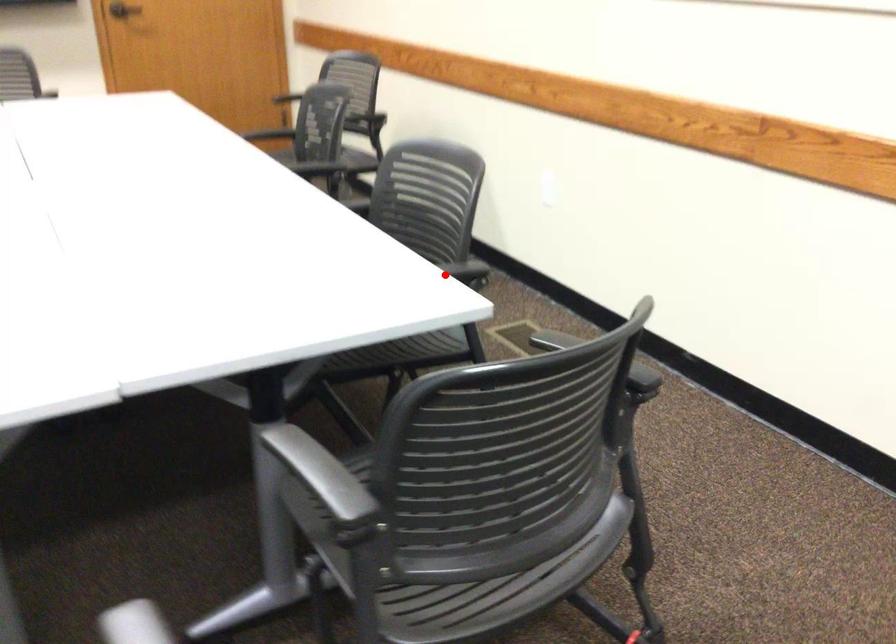
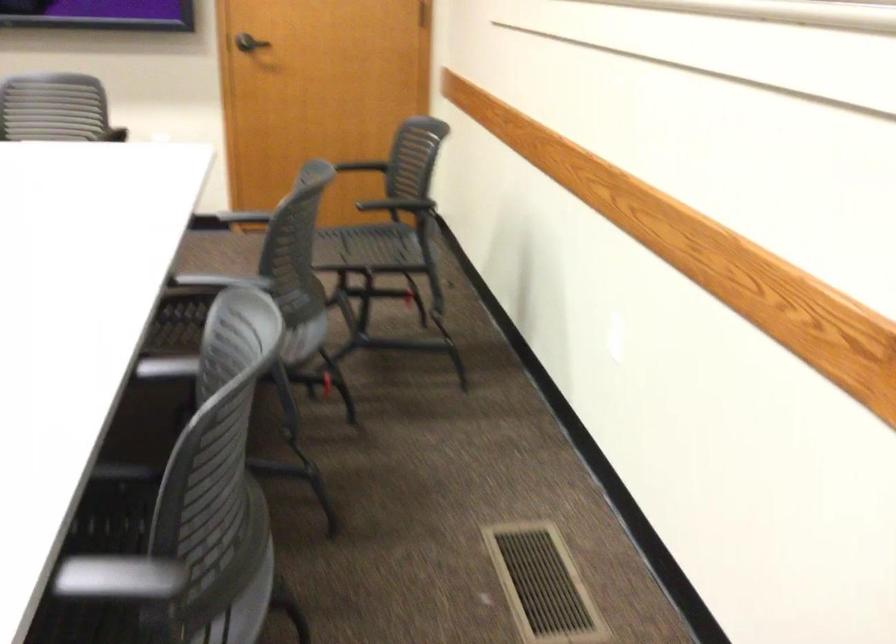
In the second image, find the point that corresponds to the highlighted location in the first image.

(118, 578)